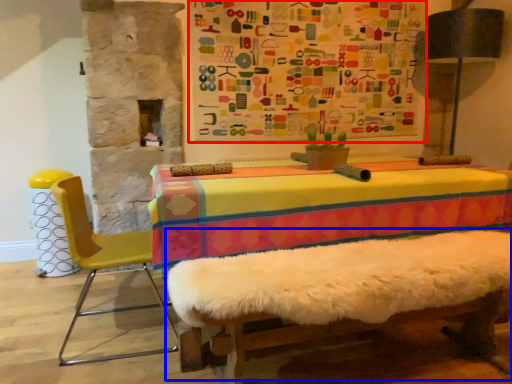
Question: Which object appears farthest to the camera in this image, bulletin board (highlighted by a red box) or bed frame (highlighted by a blue box)?

Choices:
 (A) bulletin board
 (B) bed frame

Answer: (A)